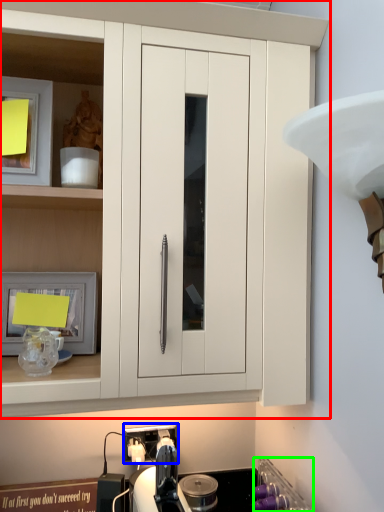
Question: Estimate the real-world distances between objects in this image. Which object is farther from cabinetry (highlighted by a red box), electric outlet (highlighted by a blue box) or appliance (highlighted by a green box)?

Choices:
 (A) electric outlet
 (B) appliance

Answer: (A)